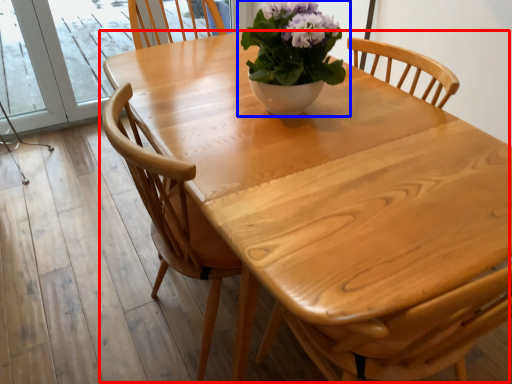
Question: Which of the following is the farthest to the observer, kitchen & dining room table (highlighted by a red box) or houseplant (highlighted by a blue box)?

Choices:
 (A) kitchen & dining room table
 (B) houseplant

Answer: (B)